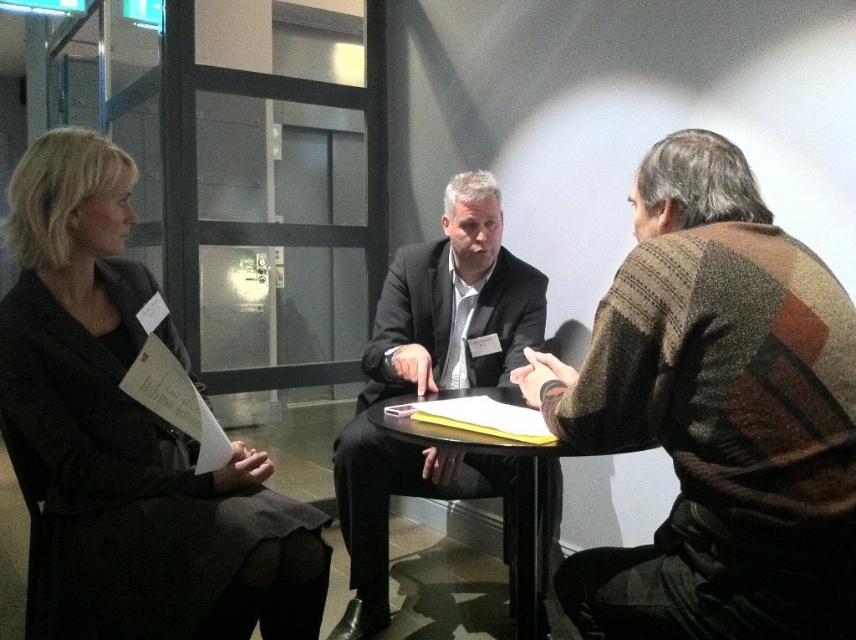
Based on the scene description, can you determine if the dark gray suit at center is resting on the black glossy table at center or positioned above it?

The dark gray suit at center is positioned above the black glossy table at center, so it is not resting on the table.

You are a photographer who needs to adjust the distance between the matte black coat at left and the camera to ensure proper focus. The optimal focus distance for your lens is 5 feet. Is the current distance sufficient?

The matte black coat at left and camera are 4.49 feet apart, which is less than the optimal 5 feet focus distance. Adjust the distance to achieve proper focus.

You are an interior designer analyzing the layout of this office space. The striped wool sweater at right is placed at a specific coordinate. Can you determine if the sweater is positioned closer to the center of the room or near the edges?

The striped wool sweater at right is located at point (715, 413), which places it closer to the edges of the room rather than the center.